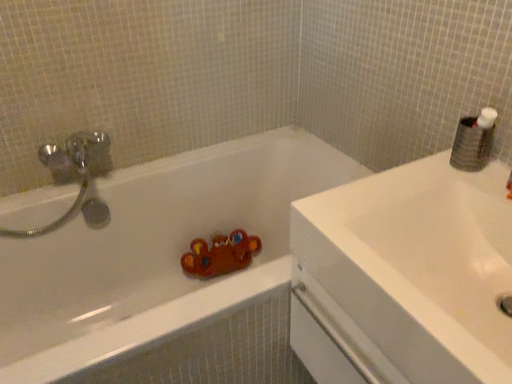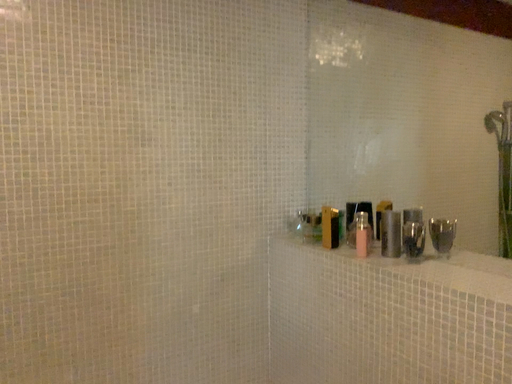
Question: Which way did the camera rotate in the video?

Choices:
 (A) rotated upward
 (B) rotated downward

Answer: (A)